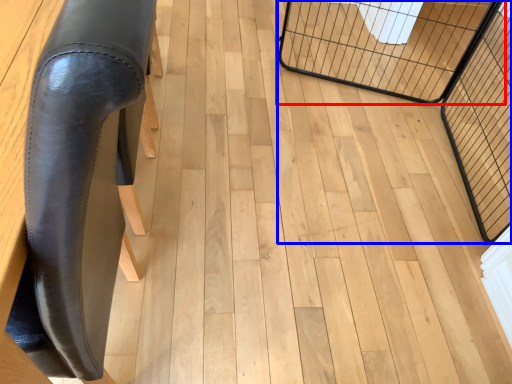
Question: Which object appears closest to the camera in this image, cage (highlighted by a red box) or cage (highlighted by a blue box)?

Choices:
 (A) cage
 (B) cage

Answer: (B)